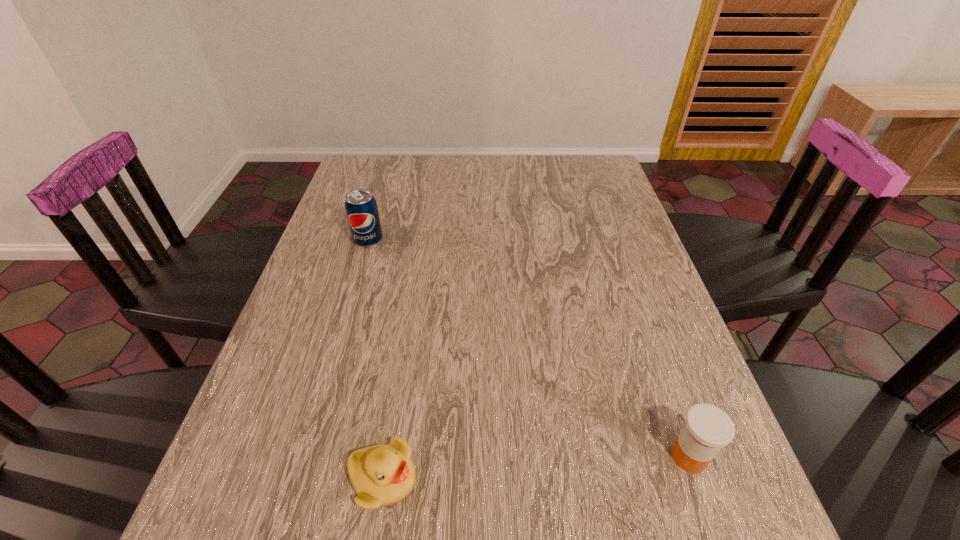
Find the location of `the tallest object`. the tallest object is located at coordinates (361, 208).

Where is `the farthest object`? the farthest object is located at coordinates (361, 208).

Where is `the rightmost object`? The image size is (960, 540). the rightmost object is located at coordinates (707, 429).

At what (x,y) coordinates should I click in order to perform the action: click on the second tallest object. Please return your answer as a coordinate pair (x, y). Looking at the image, I should click on (707, 429).

Identify the location of duckling. The height and width of the screenshot is (540, 960). (384, 474).

Find the location of a particular element. the shortest object is located at coordinates (384, 474).

The width and height of the screenshot is (960, 540). Find the location of `vacant space situated on the back of the leftmost object`. vacant space situated on the back of the leftmost object is located at coordinates (384, 187).

Identify the location of vacant area located 0.380m on the label of the rightmost object. The image size is (960, 540). (447, 456).

Locate an element on the screen. The width and height of the screenshot is (960, 540). vacant space located on the label of the rightmost object is located at coordinates (575, 456).

This screenshot has width=960, height=540. I want to click on blank space located 0.400m on the label of the rightmost object, so click(435, 456).